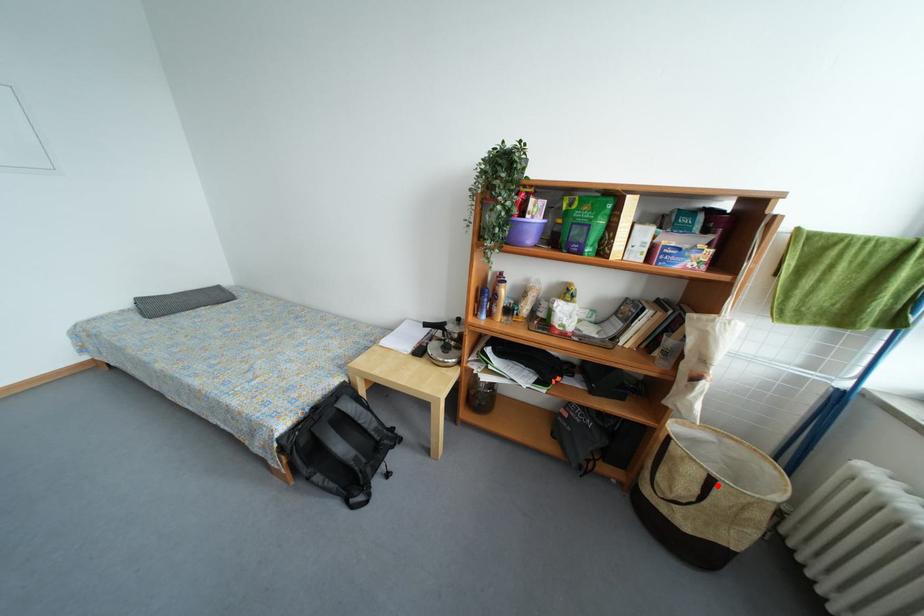
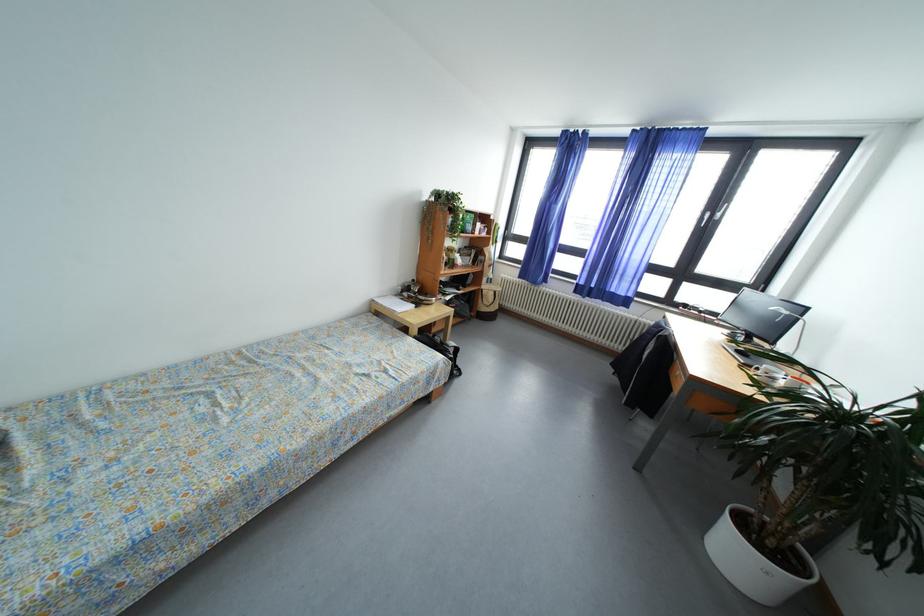
The point at the highlighted location is marked in the first image. Where is the corresponding point in the second image?

(502, 297)